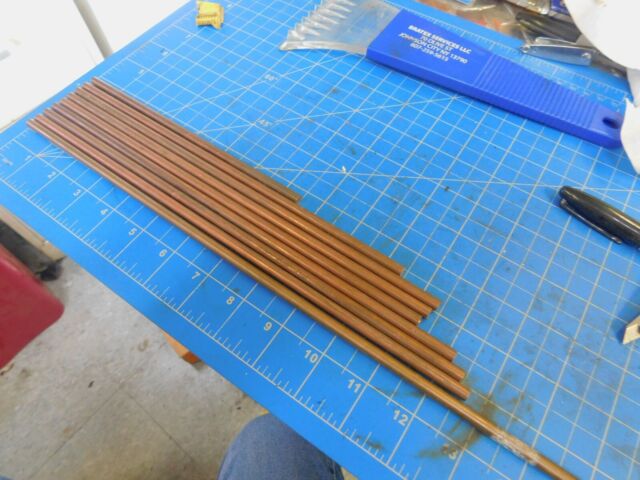
The height and width of the screenshot is (480, 640). I want to click on rods, so click(246, 175), click(242, 180), click(234, 185), click(228, 196), click(212, 204), click(204, 211), click(189, 220), click(187, 228).